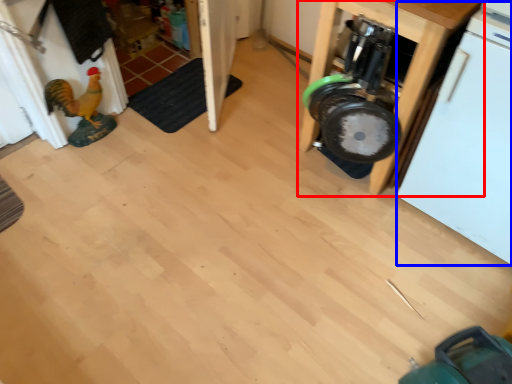
Question: Which object is further to the camera taking this photo, furniture (highlighted by a red box) or dish washer (highlighted by a blue box)?

Choices:
 (A) furniture
 (B) dish washer

Answer: (A)